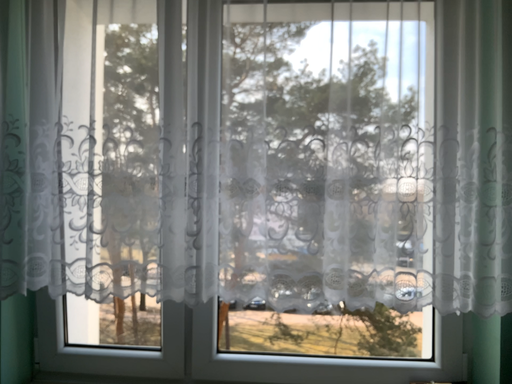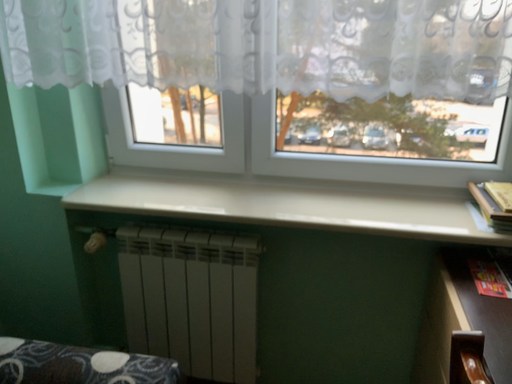
Question: Which way did the camera rotate in the video?

Choices:
 (A) rotated downward
 (B) rotated upward

Answer: (A)